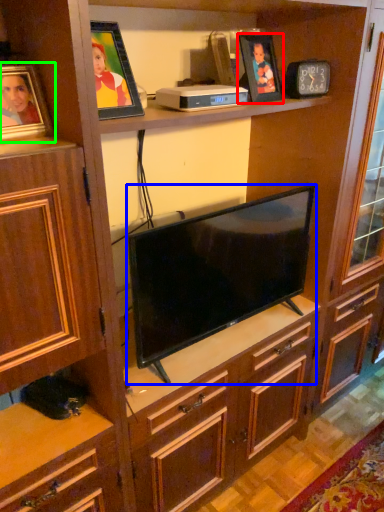
Question: Which is nearer to the picture frame (highlighted by a red box)? television (highlighted by a blue box) or picture frame (highlighted by a green box).

Choices:
 (A) television
 (B) picture frame

Answer: (A)